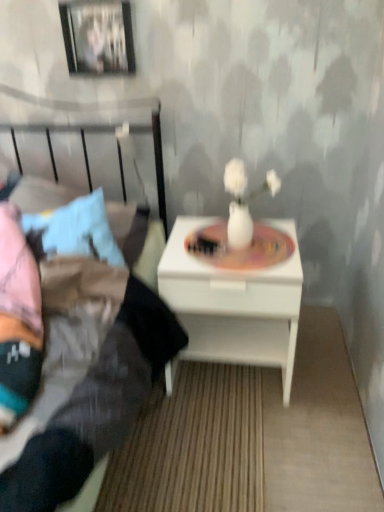
You are a GUI agent. You are given a task and a screenshot of the screen. Output one action in this format:
    pyautogui.click(x=<x>, y=<y>)
    Task: Click on the free space above white glossy nightstand at center (from a real-world perspective)
    The image size is (384, 512).
    Given the screenshot: What is the action you would take?
    pyautogui.click(x=235, y=243)